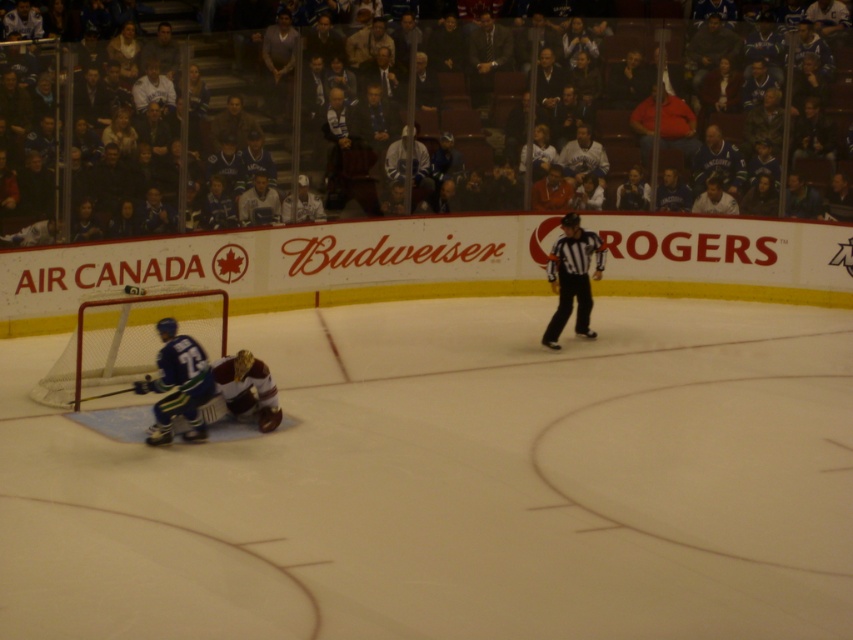
You are a hockey player trying to pass the puck to your teammate. You see the black mesh referee at center and the maroon jersey at center. Which player is closer to you if you are at the goal line?

The black mesh referee at center is positioned over maroon jersey at center, meaning the referee is closer to you than the maroon jersey at center.

You are a hockey player trying to pass the puck to your teammate. There is a black mesh referee at center and a maroon jersey at center in your way. Which object is wider so you can avoid it?

The black mesh referee at center is wider than the maroon jersey at center, so you should avoid the black mesh referee at center.

You are a spectator at the hockey game and want to take a photo of both the black mesh referee at center and the maroon jersey at center. Which one will appear larger in your photo?

The black mesh referee at center will appear larger in the photo because it is taller than the maroon jersey at center.